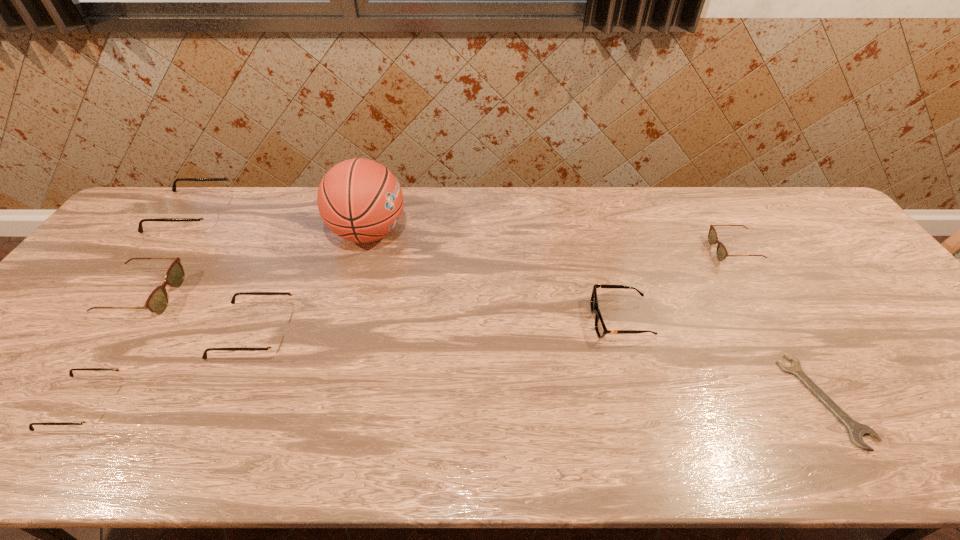
The image size is (960, 540). What are the coordinates of `free space between the biggest black spectacles and the nearest spectacles` in the screenshot? It's located at (139, 309).

At what (x,y) coordinates should I click in order to perform the action: click on free space between the left brown spectacles and the biggest black spectacles. Please return your answer as a coordinate pair (x, y). This screenshot has width=960, height=540. Looking at the image, I should click on (169, 255).

I want to click on empty location between the fourth object from left to right and the biggest black spectacles, so click(x=225, y=273).

Locate an element on the screen. The image size is (960, 540). unoccupied area between the nearest spectacles and the rightmost black spectacles is located at coordinates (170, 368).

Image resolution: width=960 pixels, height=540 pixels. What are the coordinates of `vacant area between the third object from right to left and the biggest black spectacles` in the screenshot? It's located at (407, 267).

Locate an element on the screen. This screenshot has width=960, height=540. vacant space that's between the right brown spectacles and the orange basketball is located at coordinates (551, 242).

Choose which object is the sixth nearest neighbor to the second smallest black spectacles. Please provide its 2D coordinates. Your answer should be formatted as a tuple, i.e. [(x, y)], where the tuple contains the x and y coordinates of a point satisfying the conditions above.

[(856, 430)]

Identify which object is located as the fourth nearest to the farthest black spectacles. Please provide its 2D coordinates. Your answer should be formatted as a tuple, i.e. [(x, y)], where the tuple contains the x and y coordinates of a point satisfying the conditions above.

[(95, 415)]

Find the location of a particular element. The height and width of the screenshot is (540, 960). spectacles that is the fourth closest to the smallest black spectacles is located at coordinates (722, 253).

Where is `spectacles that is the third closest to the wrench`? spectacles that is the third closest to the wrench is located at coordinates 95,415.